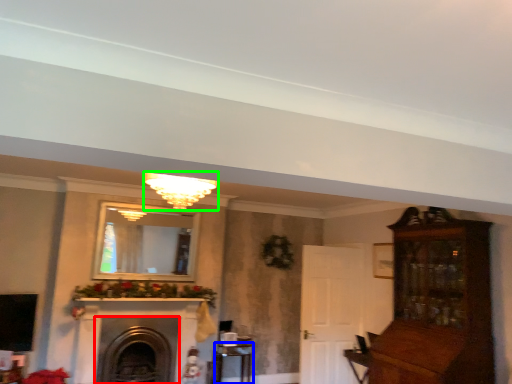
Question: Which is farther away from fireplace (highlighted by a red box)? table (highlighted by a blue box) or light fixture (highlighted by a green box)?

Choices:
 (A) table
 (B) light fixture

Answer: (B)